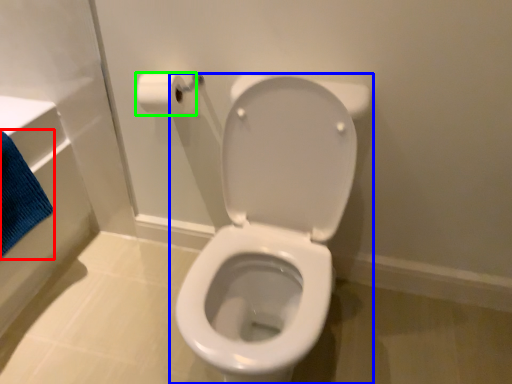
Question: Which object is positioned closest to bath towel (highlighted by a red box)? Select from toilet (highlighted by a blue box) and toilet paper (highlighted by a green box).

Choices:
 (A) toilet
 (B) toilet paper

Answer: (B)